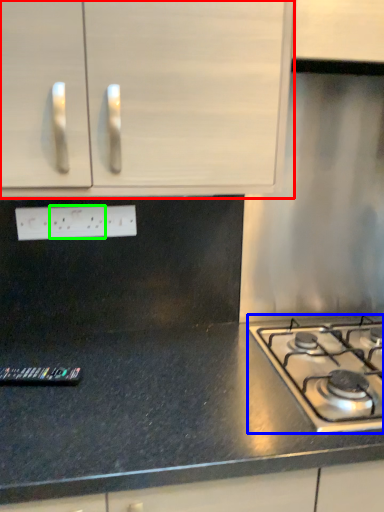
Question: Which object is the farthest from cabinetry (highlighted by a red box)? Choose among these: gas stove (highlighted by a blue box) or electric outlet (highlighted by a green box).

Choices:
 (A) gas stove
 (B) electric outlet

Answer: (A)